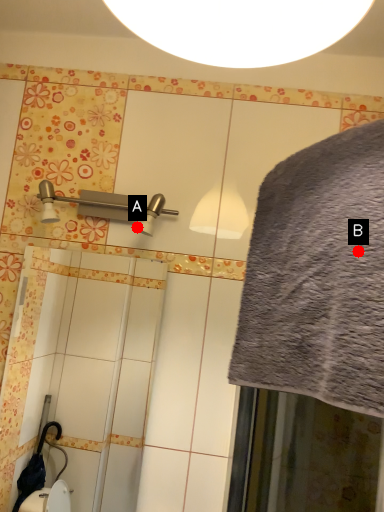
Question: Two points are circled on the image, labeled by A and B beside each circle. Among these points, which one is nearest to the camera?

Choices:
 (A) A is closer
 (B) B is closer

Answer: (B)